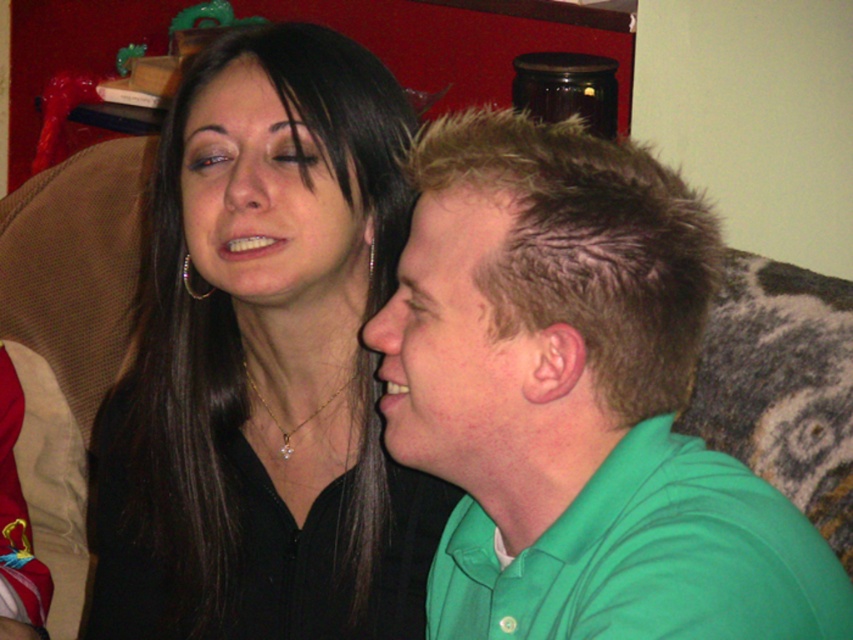
Question: Is green cotton shirt at center thinner than matte black face at upper left?

Choices:
 (A) yes
 (B) no

Answer: (B)

Question: Which point is farther to the camera?

Choices:
 (A) green cotton shirt at center
 (B) green matte shirt at right
 (C) black matte hair at upper left

Answer: (C)

Question: Does black matte hair at upper left have a greater width compared to silver metallic hoop at upper left?

Choices:
 (A) no
 (B) yes

Answer: (B)

Question: Among these points, which one is nearest to the camera?

Choices:
 (A) (384, 288)
 (B) (184, 266)
 (C) (402, 268)

Answer: (C)

Question: Which point is farther to the camera?

Choices:
 (A) silver metallic hoop at upper left
 (B) green cotton shirt at center
 (C) green matte shirt at right
 (D) matte black face at upper left

Answer: (A)

Question: Is green cotton shirt at center above silver metallic hoop at upper left?

Choices:
 (A) yes
 (B) no

Answer: (B)